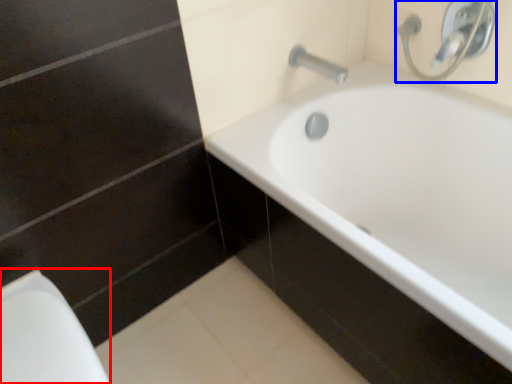
Question: Which of the following is the farthest to the observer, porcelain (highlighted by a red box) or plumbing fixture (highlighted by a blue box)?

Choices:
 (A) porcelain
 (B) plumbing fixture

Answer: (B)